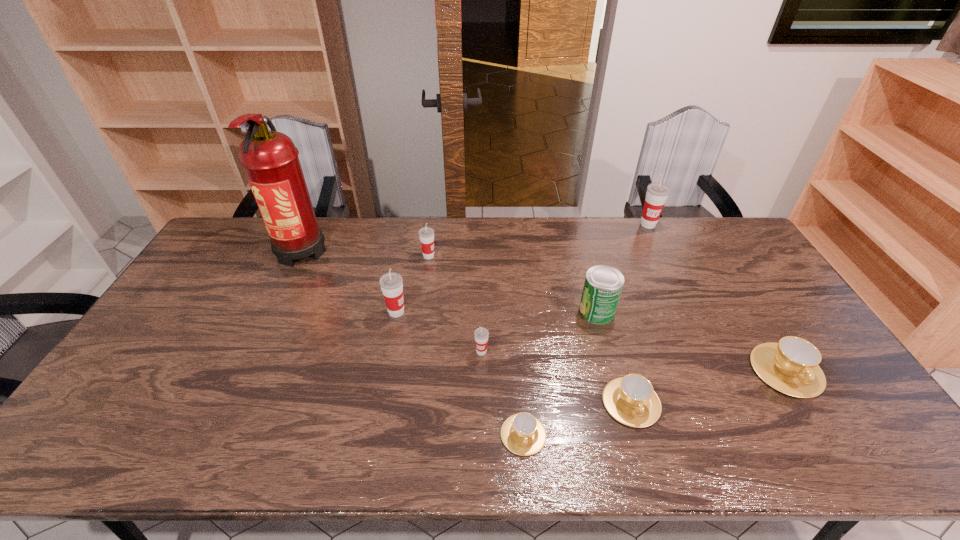
I want to click on the third cup from left to right, so click(x=481, y=334).

Image resolution: width=960 pixels, height=540 pixels. In order to click on the rightmost object in this screenshot , I will do `click(791, 366)`.

Locate an element on the screen. Image resolution: width=960 pixels, height=540 pixels. the rightmost brown cup is located at coordinates pos(791,366).

This screenshot has width=960, height=540. What are the coordinates of `the third cup from right to left` in the screenshot? It's located at (631, 400).

This screenshot has height=540, width=960. I want to click on the second brown cup from right to left, so click(x=631, y=400).

In order to click on the fourth cup from right to left in this screenshot , I will do `click(523, 434)`.

Locate an element on the screen. This screenshot has width=960, height=540. the shortest object is located at coordinates (523, 434).

At what (x,y) coordinates should I click in order to perform the action: click on vacant area located on the front-facing side of the tallest object. Please return your answer as a coordinate pair (x, y). Image resolution: width=960 pixels, height=540 pixels. Looking at the image, I should click on (284, 286).

Locate an element on the screen. Image resolution: width=960 pixels, height=540 pixels. blank area located 0.300m on the side of the second tallest object with the logo is located at coordinates (678, 285).

The width and height of the screenshot is (960, 540). Find the location of `vacant space located 0.050m on the side of the leftmost cup with the logo`. vacant space located 0.050m on the side of the leftmost cup with the logo is located at coordinates (423, 312).